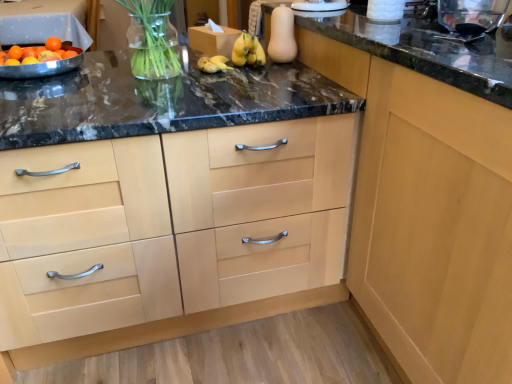
Question: From a real-world perspective, is light wood cabinet at center, which is counted as the 1th cabinetry, starting from the right, positioned above or below light wood cabinet at center, positioned as the second cabinetry in right-to-left order?

Choices:
 (A) below
 (B) above

Answer: (B)

Question: From their relative heights in the image, would you say light wood cabinet at center, the 2th cabinetry viewed from the left, is taller or shorter than light wood cabinet at center, positioned as the second cabinetry in right-to-left order?

Choices:
 (A) short
 (B) tall

Answer: (B)

Question: Which object is the closest to the light wood cabinet at center, positioned as the second cabinetry in right-to-left order?

Choices:
 (A) orange matte at upper left
 (B) light wood cabinet at center, which is counted as the 1th cabinetry, starting from the right

Answer: (B)

Question: Which object is positioned farthest from the orange matte at upper left?

Choices:
 (A) light wood cabinet at center, marked as the first cabinetry in a left-to-right arrangement
 (B) light wood cabinet at center, the 2th cabinetry viewed from the left

Answer: (B)